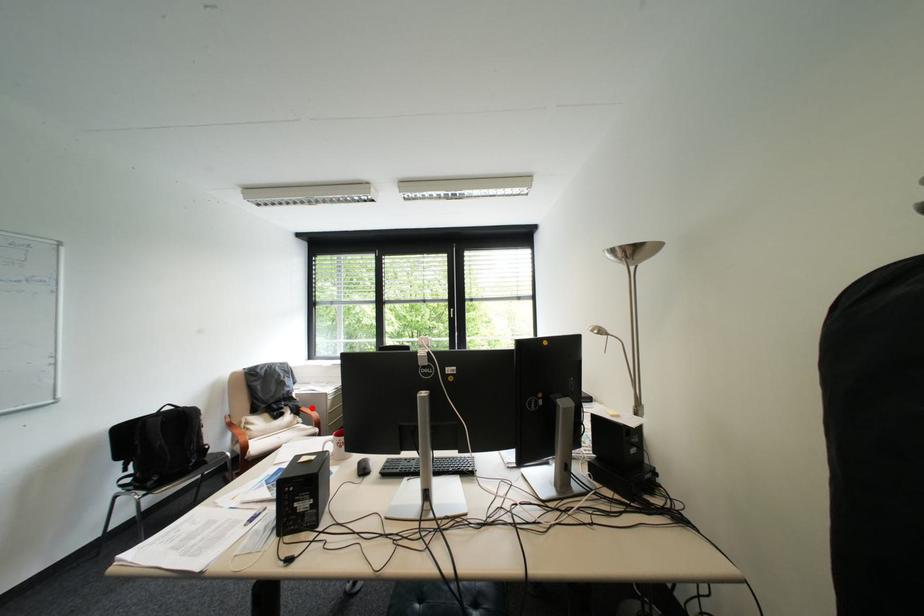
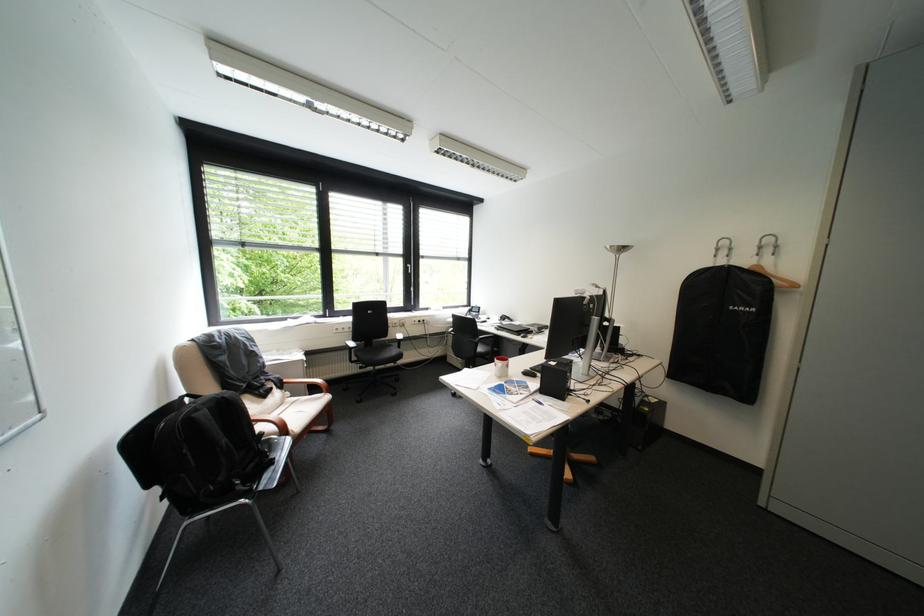
Find the pixel in the second image that matches the highlighted location in the first image.

(294, 381)